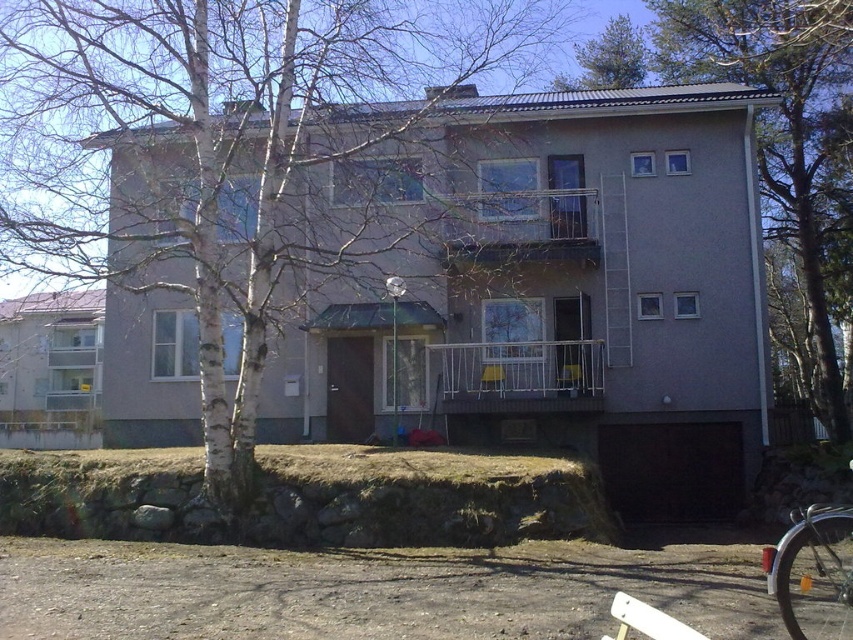
You are standing at the front of the house and want to walk to the garage door on the right side. There are two points marked on the path. Which point, point (213,58) or point (614,83), is closer to the garage door?

→ Point (213,58) is closer to the garage door because it is in front of point (614,83), which is further away from the garage door.

You are standing in front of the residential building and notice a point marked at coordinates (x=223, y=148). What object does this point correspond to?

The point corresponds to the white bark tree at center.